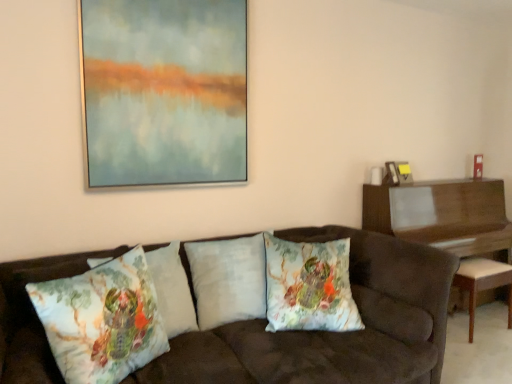
Question: Considering the relative positions of floral cotton cushion at center, positioned as the 1th pillow in right-to-left order, and matte glass painting at upper center, the first picture frame from the front, in the image provided, is floral cotton cushion at center, positioned as the 1th pillow in right-to-left order, to the left of matte glass painting at upper center, the first picture frame from the front, from the viewer's perspective?

Choices:
 (A) yes
 (B) no

Answer: (B)

Question: Is floral cotton cushion at center, positioned as the 1th pillow in right-to-left order, oriented towards matte glass painting at upper center, the first picture frame from the front?

Choices:
 (A) no
 (B) yes

Answer: (A)

Question: Considering the relative sizes of floral cotton cushion at center, acting as the fourth pillow starting from the left, and matte glass painting at upper center, the first picture frame from the front, in the image provided, is floral cotton cushion at center, acting as the fourth pillow starting from the left, taller than matte glass painting at upper center, the first picture frame from the front,?

Choices:
 (A) yes
 (B) no

Answer: (B)

Question: Can you confirm if floral cotton cushion at center, acting as the fourth pillow starting from the left, is thinner than matte glass painting at upper center, the first picture frame from the front?

Choices:
 (A) yes
 (B) no

Answer: (B)

Question: Considering the relative sizes of floral cotton cushion at center, positioned as the 1th pillow in right-to-left order, and matte glass painting at upper center, which is the third picture frame in right-to-left order, in the image provided, is floral cotton cushion at center, positioned as the 1th pillow in right-to-left order, shorter than matte glass painting at upper center, which is the third picture frame in right-to-left order,?

Choices:
 (A) yes
 (B) no

Answer: (A)

Question: From a real-world perspective, is floral cotton cushion at center, positioned as the 1th pillow in right-to-left order, positioned above or below wooden piano at right?

Choices:
 (A) below
 (B) above

Answer: (B)

Question: Visually, is floral cotton cushion at center, positioned as the 1th pillow in right-to-left order, positioned to the left or to the right of wooden piano at right?

Choices:
 (A) left
 (B) right

Answer: (A)

Question: Is floral cotton cushion at center, positioned as the 1th pillow in right-to-left order, taller or shorter than wooden piano at right?

Choices:
 (A) tall
 (B) short

Answer: (B)

Question: Choose the correct answer: Is floral cotton cushion at center, acting as the fourth pillow starting from the left, inside wooden piano at right or outside it?

Choices:
 (A) inside
 (B) outside

Answer: (B)

Question: Looking at the image, does white fabric stool at right seem bigger or smaller compared to floral-patterned fabric pillow at center, acting as the 3th pillow starting from the right?

Choices:
 (A) small
 (B) big

Answer: (B)

Question: Which is correct: white fabric stool at right is inside floral-patterned fabric pillow at center, which is the second pillow in left-to-right order, or outside of it?

Choices:
 (A) inside
 (B) outside

Answer: (B)

Question: From a real-world perspective, relative to floral-patterned fabric pillow at center, which is the second pillow in left-to-right order, is white fabric stool at right vertically above or below?

Choices:
 (A) below
 (B) above

Answer: (A)

Question: Is white fabric stool at right wider or thinner than floral-patterned fabric pillow at center, acting as the 3th pillow starting from the right?

Choices:
 (A) wide
 (B) thin

Answer: (A)

Question: Considering the positions of metallic gold picture frame at upper right, which appears as the 1th picture frame when viewed from the right, and wooden piano at right in the image, is metallic gold picture frame at upper right, which appears as the 1th picture frame when viewed from the right, wider or thinner than wooden piano at right?

Choices:
 (A) thin
 (B) wide

Answer: (A)

Question: Is metallic gold picture frame at upper right, which is the third picture frame in front-to-back order, bigger or smaller than wooden piano at right?

Choices:
 (A) small
 (B) big

Answer: (A)